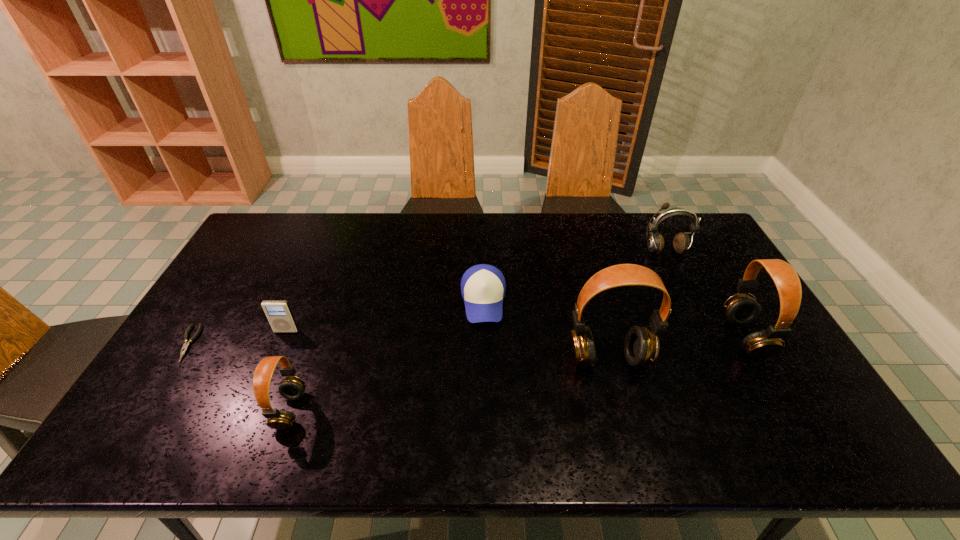
I want to click on the fifth object from right to left, so click(292, 387).

The width and height of the screenshot is (960, 540). I want to click on the fourth shortest object, so click(292, 387).

Find the location of a particular element. The height and width of the screenshot is (540, 960). the third object from right to left is located at coordinates (641, 346).

This screenshot has height=540, width=960. What are the coordinates of `the rightmost headset` in the screenshot? It's located at (740, 309).

I want to click on the second tallest object, so click(740, 309).

The height and width of the screenshot is (540, 960). What are the coordinates of `earphone` in the screenshot? It's located at (681, 243).

Locate an element on the screen. The image size is (960, 540). iPod is located at coordinates (278, 313).

Image resolution: width=960 pixels, height=540 pixels. Identify the location of the second object from left to right. (278, 313).

This screenshot has width=960, height=540. I want to click on the leftmost object, so [186, 345].

In order to click on the shortest object in this screenshot , I will do `click(186, 345)`.